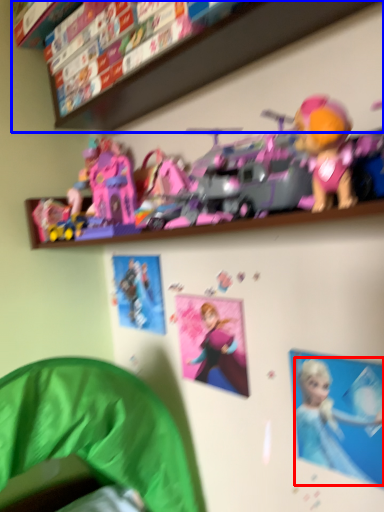
Question: Which point is closer to the camera, person (highlighted by a red box) or shelf (highlighted by a blue box)?

Choices:
 (A) person
 (B) shelf

Answer: (B)